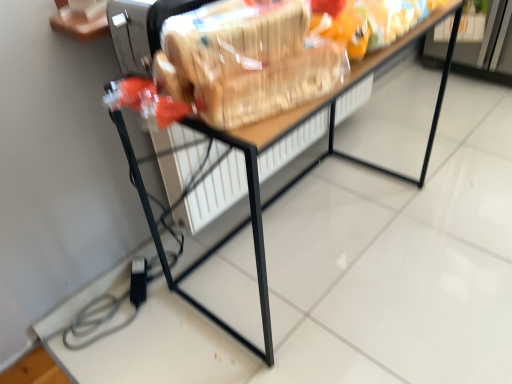
Question: Considering the positions of wooden table at center and translucent plastic bag at center in the image, is wooden table at center taller or shorter than translucent plastic bag at center?

Choices:
 (A) short
 (B) tall

Answer: (B)

Question: Looking at the image, does wooden table at center seem bigger or smaller compared to translucent plastic bag at center?

Choices:
 (A) small
 (B) big

Answer: (B)

Question: From the image's perspective, is wooden table at center located above or below translucent plastic bag at center?

Choices:
 (A) above
 (B) below

Answer: (B)

Question: Relative to wooden table at center, is translucent plastic bag at center in front or behind?

Choices:
 (A) behind
 (B) front

Answer: (B)

Question: Is translucent plastic bag at center inside or outside of wooden table at center?

Choices:
 (A) inside
 (B) outside

Answer: (B)

Question: From a real-world perspective, relative to wooden table at center, is translucent plastic bag at center vertically above or below?

Choices:
 (A) below
 (B) above

Answer: (B)

Question: Is point (205, 28) closer or farther from the camera than point (138, 175)?

Choices:
 (A) closer
 (B) farther

Answer: (A)